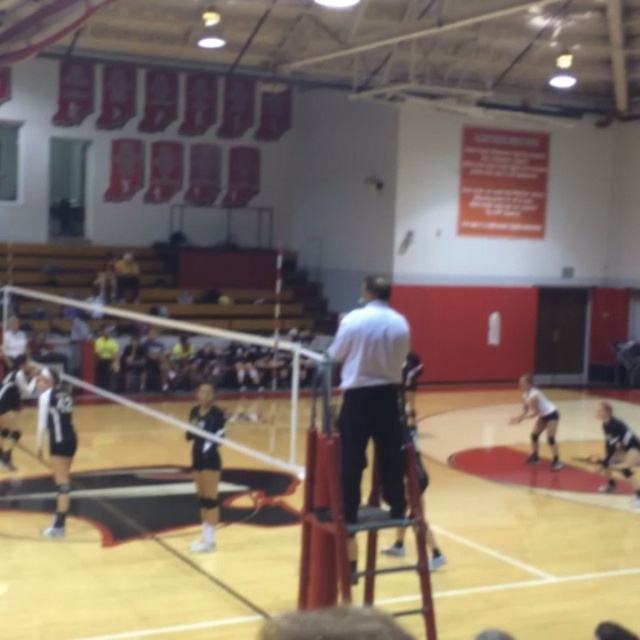
Looking at this image, can you confirm if white matte shirt at center is positioned to the left of black jersey at lower right?

Yes, white matte shirt at center is to the left of black jersey at lower right.

Who is shorter, white matte shirt at center or black jersey at lower right?

With less height is white matte shirt at center.

Does point (387, 353) come farther from viewer compared to point (605, 448)?

No, (387, 353) is closer to viewer.

Locate an element on the screen. white matte shirt at center is located at coordinates (371, 394).

Which is behind, point (52, 444) or point (604, 456)?

Positioned behind is point (604, 456).

Is point (49, 422) positioned behind point (616, 456)?

No, (49, 422) is closer to viewer.

Identify the location of black jersey at left. (54, 440).

Can you confirm if black uniform at center is wider than black athletic uniform at left?

No, black uniform at center is not wider than black athletic uniform at left.

Does black uniform at center appear over black athletic uniform at left?

No.

Measure the distance between black uniform at center and camera.

They are 7.91 meters apart.

Locate an element on the screen. black uniform at center is located at coordinates (204, 488).